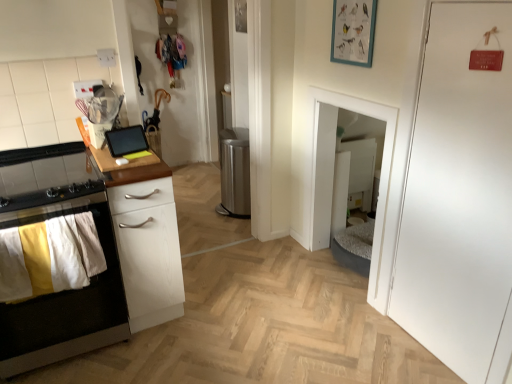
What do you see at coordinates (66, 309) in the screenshot?
I see `white matte cabinet at left` at bounding box center [66, 309].

The image size is (512, 384). What do you see at coordinates (148, 251) in the screenshot?
I see `white wood chest of drawers at left` at bounding box center [148, 251].

What is the approximate width of yellow and white fabric at left?

yellow and white fabric at left is 2.97 inches in width.

This screenshot has width=512, height=384. Describe the element at coordinates (234, 173) in the screenshot. I see `stainless steel trash can at center, which is the 1th appliance in back-to-front order` at that location.

The image size is (512, 384). What do you see at coordinates (459, 195) in the screenshot?
I see `white matte door at right` at bounding box center [459, 195].

You are a GUI agent. You are given a task and a screenshot of the screen. Output one action in this format:
    pyautogui.click(x=<x>, y=<y>)
    Task: Click on the white matte door at right
    This screenshot has height=384, width=512.
    Given the screenshot: What is the action you would take?
    pyautogui.click(x=459, y=195)

Find the location of a particular element. This screenshot has height=384, width=512. teal matte picture frame at upper center is located at coordinates (353, 32).

From the picture: Is stainless steel trash can at center, the first appliance positioned from the right, thinner than white wood chest of drawers at left?

Yes.

Which is further, (234,171) or (119,232)?

The point (234,171) is farther.

In the scene shown: Can you confirm if stainless steel trash can at center, which is the 2th appliance from left to right, is bigger than white wood chest of drawers at left?

No, stainless steel trash can at center, which is the 2th appliance from left to right, is not bigger than white wood chest of drawers at left.

Between point (129, 137) and point (134, 307), which one is positioned in front?

Positioned in front is point (129, 137).

Does matte black tablet at upper left, the 2th appliance viewed from the right, turn towards white wood chest of drawers at left?

No, matte black tablet at upper left, the 2th appliance viewed from the right, does not turn towards white wood chest of drawers at left.

Is matte black tablet at upper left, the 2th appliance viewed from the right, wider than white wood chest of drawers at left?

Incorrect, the width of matte black tablet at upper left, the 2th appliance viewed from the right, does not surpass that of white wood chest of drawers at left.

In the scene shown: From a real-world perspective, is white matte cabinet at left physically located above or below teal matte picture frame at upper center?

white matte cabinet at left is below teal matte picture frame at upper center.

Is white matte cabinet at left bigger or smaller than teal matte picture frame at upper center?

In the image, white matte cabinet at left appears to be larger than teal matte picture frame at upper center.

Is point (42, 343) in front of point (353, 15)?

Yes, point (42, 343) is in front of point (353, 15).

Which is more to the right, white matte cabinet at left or teal matte picture frame at upper center?

Positioned to the right is teal matte picture frame at upper center.

From a real-world perspective, which object rests below the other?

From a 3D spatial view, white matte cabinet at left is below.

Would you say white matte cabinet at left is part of white wood chest of drawers at left's contents?

No, white matte cabinet at left is not inside white wood chest of drawers at left.

Looking at this image, does white wood chest of drawers at left turn towards white matte cabinet at left?

No, white wood chest of drawers at left is not facing towards white matte cabinet at left.

Which of these two, white wood chest of drawers at left or white matte cabinet at left, is bigger?

Bigger between the two is white matte cabinet at left.

Which appliance is the 2nd one when counting from the left side of the white matte door at right? Please provide its 2D coordinates.

[(126, 140)]

What's the angular difference between matte black tablet at upper left, the 2th appliance viewed from the right, and white matte door at right's facing directions?

matte black tablet at upper left, the 2th appliance viewed from the right, and white matte door at right are facing 102 degrees away from each other.

Is matte black tablet at upper left, which is the first appliance from front to back, thinner than white matte door at right?

No, matte black tablet at upper left, which is the first appliance from front to back, is not thinner than white matte door at right.

Based on the photo, from the image's perspective, which object appears higher, matte black tablet at upper left, which ranks as the second appliance in back-to-front order, or white matte door at right?

From the image's view, matte black tablet at upper left, which ranks as the second appliance in back-to-front order, is above.

Who is smaller, yellow and white fabric at left or stainless steel trash can at center, the first appliance positioned from the right?

Smaller between the two is yellow and white fabric at left.

Is yellow and white fabric at left not close to stainless steel trash can at center, which is the 2th appliance from front to back?

Yes.

How much distance is there between yellow and white fabric at left and stainless steel trash can at center, which is the 2th appliance from front to back?

yellow and white fabric at left and stainless steel trash can at center, which is the 2th appliance from front to back, are 5.78 feet apart from each other.

From a real-world perspective, between yellow and white fabric at left and stainless steel trash can at center, the first appliance positioned from the right, who is vertically higher?

yellow and white fabric at left.

Does stainless steel trash can at center, which is the 2th appliance from front to back, come behind yellow and white fabric at left?

Yes.

Can you confirm if stainless steel trash can at center, which is the 2th appliance from left to right, is positioned to the right of yellow and white fabric at left?

Yes.

Considering the points (230, 176) and (64, 238), which point is in front, point (230, 176) or point (64, 238)?

Point (64, 238)

Could you tell me if stainless steel trash can at center, which is the 2th appliance from front to back, is turned towards yellow and white fabric at left?

No, stainless steel trash can at center, which is the 2th appliance from front to back, is not facing towards yellow and white fabric at left.

Image resolution: width=512 pixels, height=384 pixels. I want to click on the chest of drawers below the stainless steel trash can at center, which is the 2th appliance from front to back (from the image's perspective), so click(148, 251).

The width and height of the screenshot is (512, 384). What are the coordinates of `chest of drawers located on the right of matte black tablet at upper left, the 2th appliance viewed from the right` in the screenshot? It's located at (148, 251).

When comparing their distances from white matte cabinet at left, does white matte door at right or stainless steel trash can at center, which is the 1th appliance in back-to-front order, seem closer?

The object closer to white matte cabinet at left is white matte door at right.

Looking at the image, which one is located closer to stainless steel trash can at center, which is the 2th appliance from front to back, white matte door at right or yellow and white fabric at left?

yellow and white fabric at left lies closer to stainless steel trash can at center, which is the 2th appliance from front to back, than the other object.

Considering their positions, is teal matte picture frame at upper center positioned closer to white wood chest of drawers at left than stainless steel trash can at center, the first appliance positioned from the right?

teal matte picture frame at upper center is closer to white wood chest of drawers at left.

Which object lies nearer to the anchor point stainless steel trash can at center, which is the 1th appliance in back-to-front order, teal matte picture frame at upper center or matte black tablet at upper left, which ranks as the 1th appliance in left-to-right order?

Based on the image, matte black tablet at upper left, which ranks as the 1th appliance in left-to-right order, appears to be nearer to stainless steel trash can at center, which is the 1th appliance in back-to-front order.

Considering their positions, is matte black tablet at upper left, the 2th appliance viewed from the right, positioned closer to teal matte picture frame at upper center than white wood chest of drawers at left?

The object closer to teal matte picture frame at upper center is matte black tablet at upper left, the 2th appliance viewed from the right.

From the image, which object appears to be farther from matte black tablet at upper left, which is the first appliance from front to back, white matte cabinet at left or yellow and white fabric at left?

white matte cabinet at left is positioned further to the anchor matte black tablet at upper left, which is the first appliance from front to back.

From the image, which object appears to be farther from teal matte picture frame at upper center, white wood chest of drawers at left or stainless steel trash can at center, which is the 1th appliance in back-to-front order?

stainless steel trash can at center, which is the 1th appliance in back-to-front order.

Which object lies nearer to the anchor point white wood chest of drawers at left, white matte door at right or stainless steel trash can at center, which is the 2th appliance from front to back?

white matte door at right lies closer to white wood chest of drawers at left than the other object.

In order to click on laundry located between white matte door at right and stainless steel trash can at center, which is the 2th appliance from front to back, in the depth direction in this screenshot , I will do `click(49, 257)`.

Image resolution: width=512 pixels, height=384 pixels. I want to click on chest of drawers between yellow and white fabric at left and teal matte picture frame at upper center from left to right, so click(x=148, y=251).

The image size is (512, 384). Identify the location of picture frame situated between white matte cabinet at left and white matte door at right from left to right. (353, 32).

Identify the location of chest of drawers between white matte cabinet at left and teal matte picture frame at upper center in the horizontal direction. Image resolution: width=512 pixels, height=384 pixels. (148, 251).